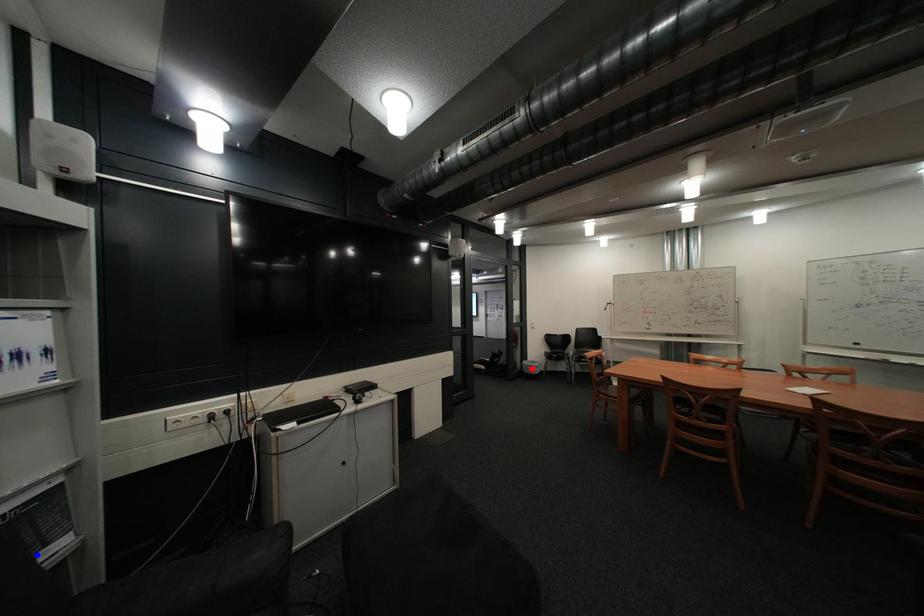
Question: In the image, two points are highlighted. Which point is nearer to the camera? Reply with the corresponding letter.

Choices:
 (A) blue point
 (B) red point

Answer: (A)